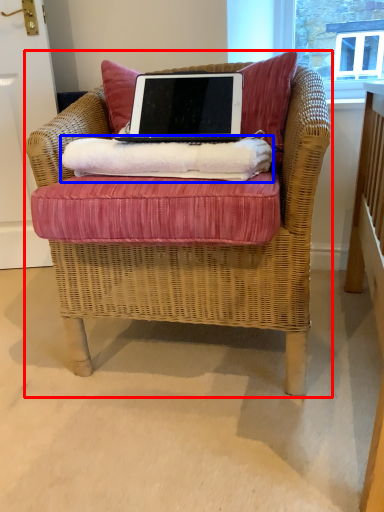
Question: Which point is further to the camera, chair (highlighted by a red box) or material (highlighted by a blue box)?

Choices:
 (A) chair
 (B) material

Answer: (B)